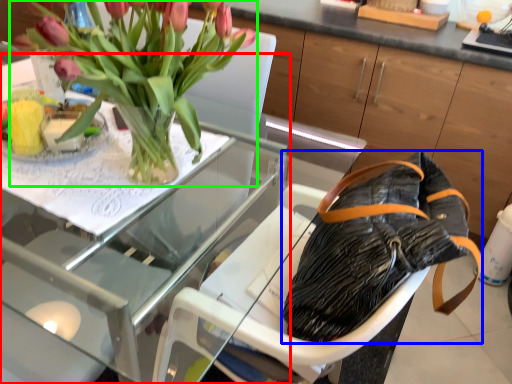
Question: Which object is the closest to the table (highlighted by a red box)? Choose among these: handbag (highlighted by a blue box) or houseplant (highlighted by a green box).

Choices:
 (A) handbag
 (B) houseplant

Answer: (B)